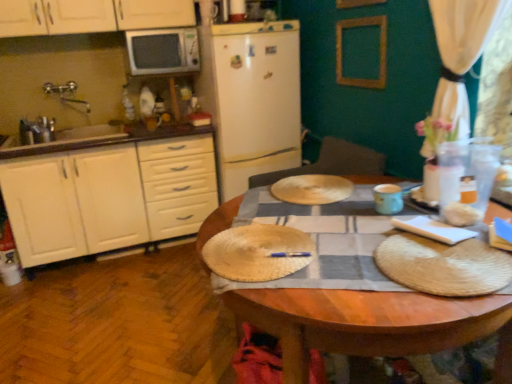
I want to click on free space above bamboo placemat at center (from a real-world perspective), so click(261, 243).